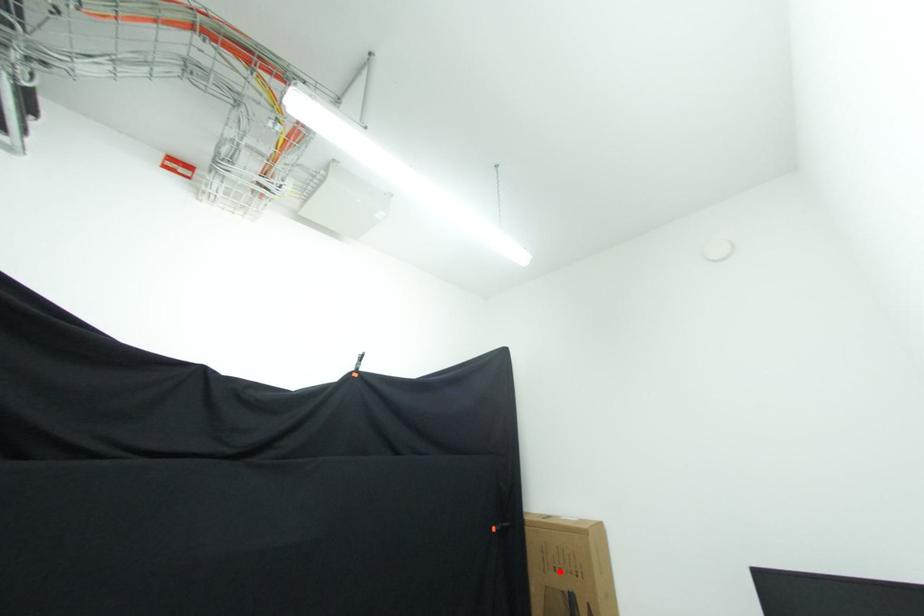
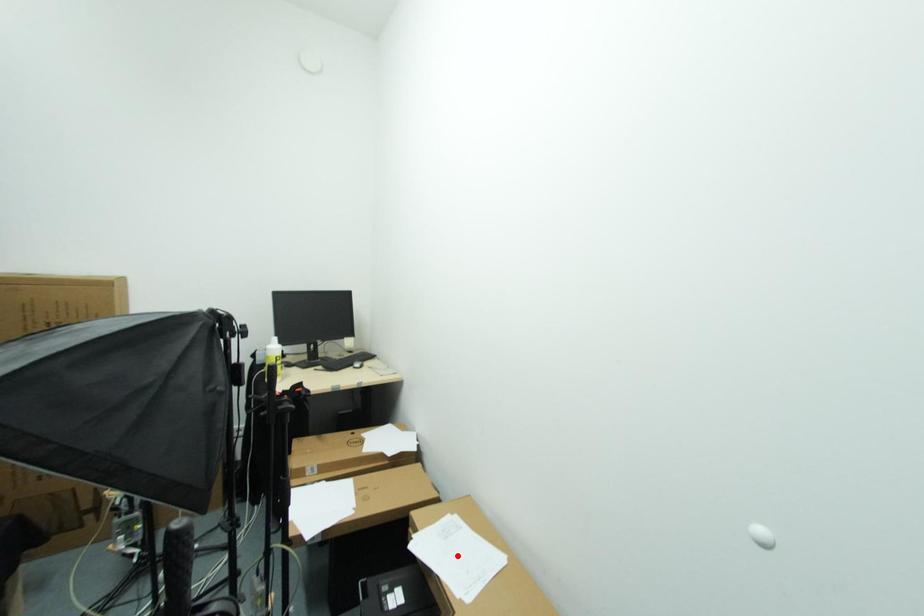
I am providing you with two images of the same scene from different viewpoints. A red point is marked on the first image and another point is marked on the second image. Is the marked point in image1 the same physical position as the marked point in image2?

No